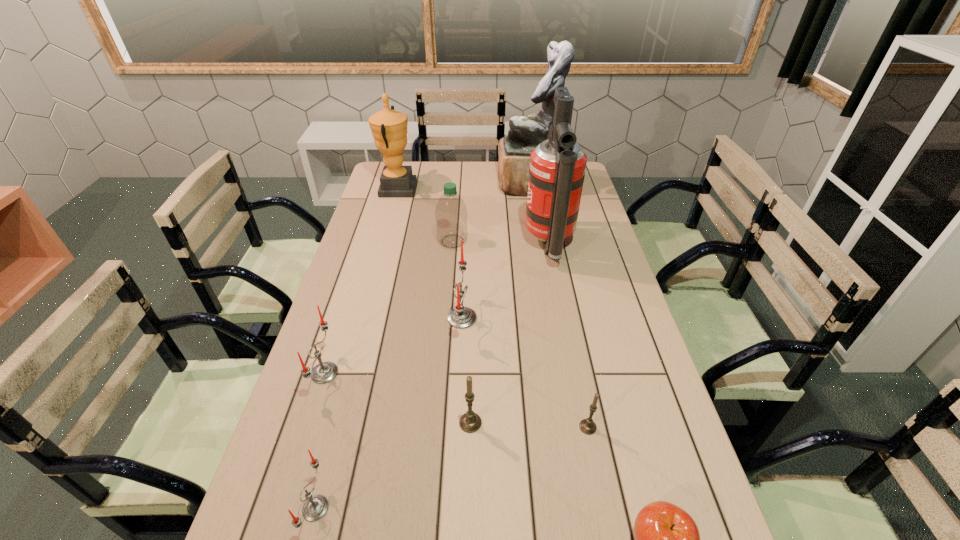
Find the location of a particular element. This screenshot has height=540, width=960. object that is at the far left corner is located at coordinates (389, 127).

The image size is (960, 540). In order to click on object that is at the far right corner in this screenshot , I will do `click(525, 133)`.

This screenshot has width=960, height=540. Find the location of `vacant space at the left edge of the desktop`. vacant space at the left edge of the desktop is located at coordinates (306, 387).

The width and height of the screenshot is (960, 540). In the image, there is a desktop. Find the location of `vacant space at the right edge`. vacant space at the right edge is located at coordinates (574, 276).

The width and height of the screenshot is (960, 540). Find the location of `blank region between the sculpture and the farthest candle`. blank region between the sculpture and the farthest candle is located at coordinates [497, 251].

The image size is (960, 540). Identify the location of free point between the fire extinguisher and the rightmost candle. (568, 336).

Where is `vacant point located between the eighth shortest object and the red fire extinguisher`? The image size is (960, 540). vacant point located between the eighth shortest object and the red fire extinguisher is located at coordinates (473, 217).

The width and height of the screenshot is (960, 540). Find the location of `free area in between the sculpture and the award`. free area in between the sculpture and the award is located at coordinates (465, 187).

Where is `unoccupied area between the water bottle and the rightmost candle`? Image resolution: width=960 pixels, height=540 pixels. unoccupied area between the water bottle and the rightmost candle is located at coordinates (520, 334).

Identify which object is the closest to the golden award. Please provide its 2D coordinates. Your answer should be formatted as a tuple, i.e. [(x, y)], where the tuple contains the x and y coordinates of a point satisfying the conditions above.

[(451, 214)]